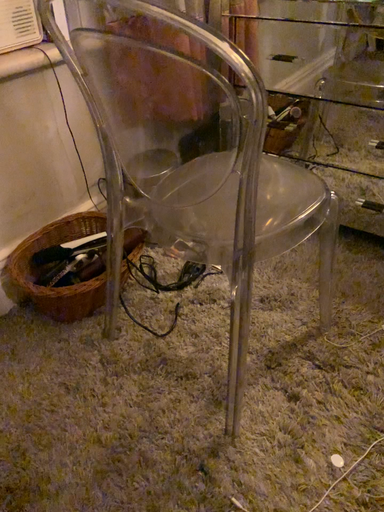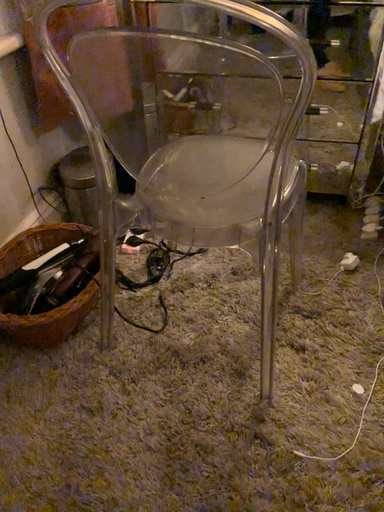
Question: How did the camera likely rotate when shooting the video?

Choices:
 (A) rotated left
 (B) rotated right

Answer: (B)